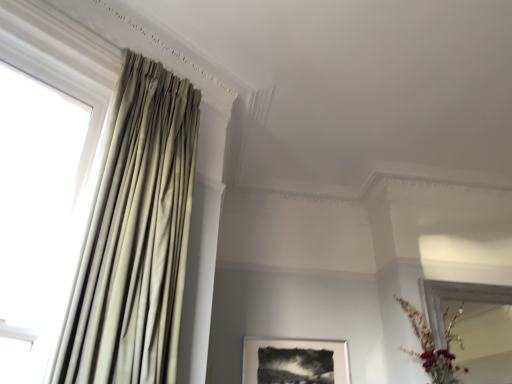
Question: Can you confirm if black matte picture frame at center is thinner than satin beige curtain at left?

Choices:
 (A) no
 (B) yes

Answer: (B)

Question: Is black matte picture frame at center taller than satin beige curtain at left?

Choices:
 (A) no
 (B) yes

Answer: (A)

Question: Does black matte picture frame at center lie behind satin beige curtain at left?

Choices:
 (A) yes
 (B) no

Answer: (A)

Question: Considering the relative sizes of black matte picture frame at center and satin beige curtain at left in the image provided, is black matte picture frame at center smaller than satin beige curtain at left?

Choices:
 (A) no
 (B) yes

Answer: (B)

Question: From the image's perspective, is black matte picture frame at center under satin beige curtain at left?

Choices:
 (A) no
 (B) yes

Answer: (B)

Question: Considering the relative sizes of black matte picture frame at center and satin beige curtain at left in the image provided, is black matte picture frame at center shorter than satin beige curtain at left?

Choices:
 (A) yes
 (B) no

Answer: (A)

Question: Could you tell me if white fabric curtain at left is turned towards black matte picture frame at center?

Choices:
 (A) yes
 (B) no

Answer: (B)

Question: Considering the relative sizes of white fabric curtain at left and black matte picture frame at center in the image provided, is white fabric curtain at left taller than black matte picture frame at center?

Choices:
 (A) no
 (B) yes

Answer: (B)

Question: Would you say white fabric curtain at left is a long distance from black matte picture frame at center?

Choices:
 (A) yes
 (B) no

Answer: (A)

Question: Is white fabric curtain at left positioned before black matte picture frame at center?

Choices:
 (A) yes
 (B) no

Answer: (A)

Question: Is white fabric curtain at left shorter than black matte picture frame at center?

Choices:
 (A) no
 (B) yes

Answer: (A)

Question: Is white fabric curtain at left placed right next to black matte picture frame at center?

Choices:
 (A) no
 (B) yes

Answer: (A)

Question: Is white fabric curtain at left located within satin beige curtain at left?

Choices:
 (A) no
 (B) yes

Answer: (A)